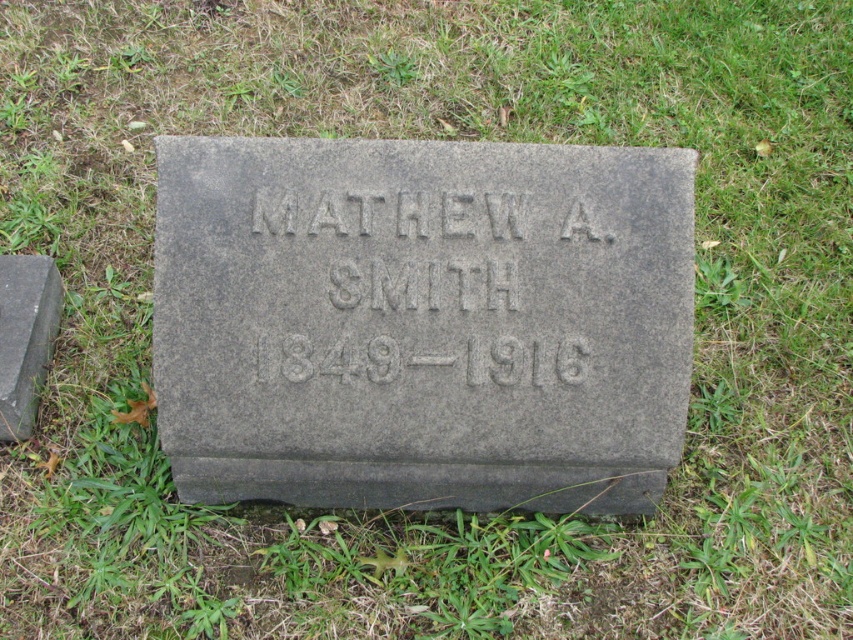
Question: Which is farther from the gray stone inscription at center?

Choices:
 (A) gray stone at left
 (B) gray stone gravestone at center

Answer: (A)

Question: Observing the image, what is the correct spatial positioning of gray stone gravestone at center in reference to gray stone inscription at center?

Choices:
 (A) right
 (B) left

Answer: (B)

Question: Which object is farther from the camera taking this photo?

Choices:
 (A) gray stone gravestone at center
 (B) gray stone inscription at center

Answer: (B)

Question: Does gray stone inscription at center have a larger size compared to gray stone at left?

Choices:
 (A) no
 (B) yes

Answer: (A)

Question: Which point is closer to the camera?

Choices:
 (A) (473, 305)
 (B) (3, 253)
 (C) (426, 198)

Answer: (A)

Question: Does gray stone gravestone at center appear on the left side of gray stone at left?

Choices:
 (A) yes
 (B) no

Answer: (B)